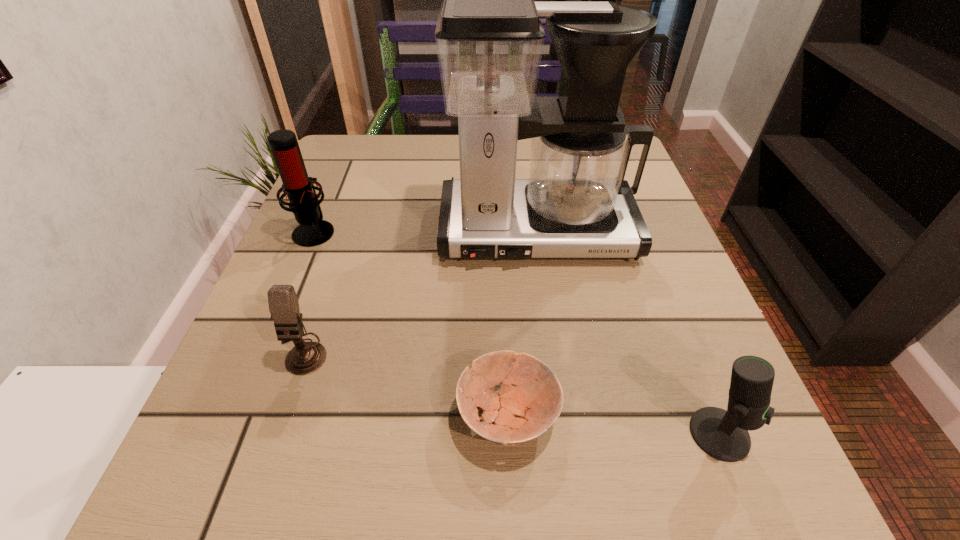
This screenshot has height=540, width=960. Identify the location of vacant space located 0.220m on the back of the bowl. (501, 271).

Identify the location of microphone at the near edge. (723, 434).

You are a GUI agent. You are given a task and a screenshot of the screen. Output one action in this format:
    pyautogui.click(x=<x>, y=<y>)
    Task: Click on the bowl that is at the near edge
    This screenshot has width=960, height=540.
    Given the screenshot: What is the action you would take?
    coord(521,413)

Locate an element on the screen. coffee maker at the right edge is located at coordinates (575, 203).

Find the location of a particular element. microphone located in the right edge section of the desktop is located at coordinates (723, 434).

Locate an element on the screen. The height and width of the screenshot is (540, 960). object at the near right corner is located at coordinates (723, 434).

In the image, there is a desktop. Find the location of `vacant space at the far edge`. vacant space at the far edge is located at coordinates (457, 171).

The image size is (960, 540). Find the location of `free region at the near edge of the desktop`. free region at the near edge of the desktop is located at coordinates (x=621, y=478).

Find the location of `blank space at the left edge of the desktop`. blank space at the left edge of the desktop is located at coordinates (227, 421).

Where is `free space at the right edge of the desktop`? Image resolution: width=960 pixels, height=540 pixels. free space at the right edge of the desktop is located at coordinates (699, 392).